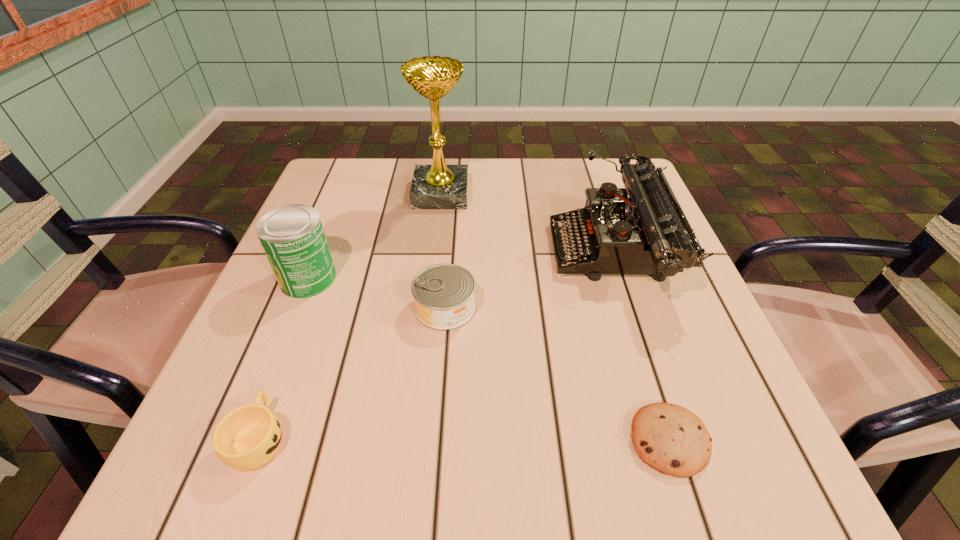
I want to click on free spot located on the keyboard of the typewriter, so click(x=486, y=253).

Find the location of `vacant position located on the right of the taller can`. vacant position located on the right of the taller can is located at coordinates (385, 278).

What are the coordinates of `blank space located 0.250m on the left of the right can` in the screenshot? It's located at (280, 307).

Find the location of a particular element. This screenshot has height=540, width=960. vacant space located 0.340m on the back of the cup is located at coordinates (326, 258).

You are a GUI agent. You are given a task and a screenshot of the screen. Output one action in this format:
    pyautogui.click(x=<x>, y=<y>)
    Task: Click on the free space located 0.280m on the back of the cookie
    This screenshot has width=960, height=540.
    Given the screenshot: What is the action you would take?
    pyautogui.click(x=617, y=279)

Where is `award at the far edge`? Image resolution: width=960 pixels, height=540 pixels. award at the far edge is located at coordinates (438, 186).

Where is `typewriter located in the far edge section of the desktop`? The image size is (960, 540). typewriter located in the far edge section of the desktop is located at coordinates (645, 234).

The image size is (960, 540). Find the location of `cup present at the near edge`. cup present at the near edge is located at coordinates (246, 438).

Locate an element on the screen. The image size is (960, 540). cookie that is positioned at the near edge is located at coordinates (671, 439).

Where is `can positioned at the left edge`? can positioned at the left edge is located at coordinates (292, 236).